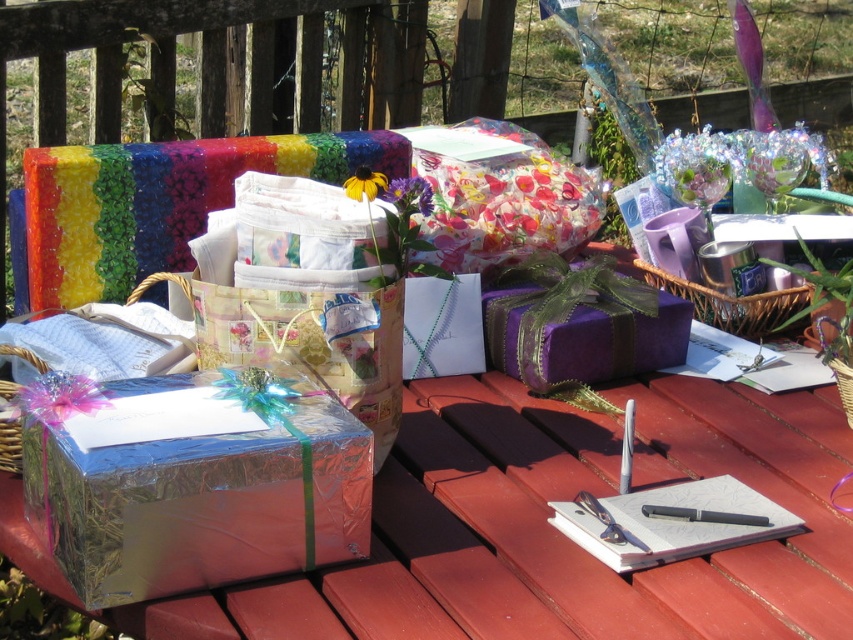
Question: In this image, where is shiny metallic gift box at lower left located relative to purple satin gift at center?

Choices:
 (A) left
 (B) right

Answer: (A)

Question: Which is nearer to the purple satin gift at center?

Choices:
 (A) woven brown basket at lower right
 (B) shiny metallic gift box at lower left
 (C) metallic silver basket at lower left
 (D) floral-patterned gift wrap at center

Answer: (D)

Question: Which object appears farthest from the camera in this image?

Choices:
 (A) translucent purple ribbon at lower left
 (B) woven brown basket at center

Answer: (B)

Question: Which of the following is the closest to the observer?

Choices:
 (A) metallic silver basket at lower left
 (B) purple satin gift at center
 (C) purple floral bouquet at center
 (D) black plastic pen at center

Answer: (A)

Question: Can you confirm if woven brown basket at center is positioned to the left of metallic silver basket at lower left?

Choices:
 (A) yes
 (B) no

Answer: (B)

Question: Can you confirm if shiny metallic gift box at lower left is positioned to the left of black plastic pen at center?

Choices:
 (A) yes
 (B) no

Answer: (A)